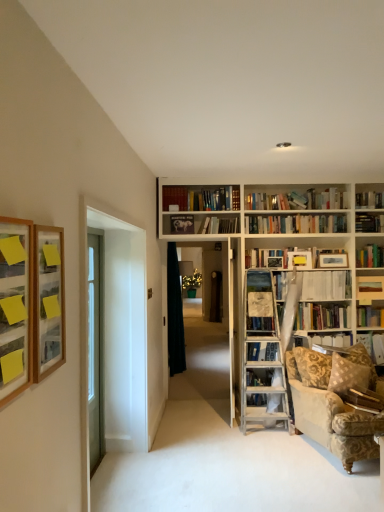
Question: Considering the relative sizes of clear glass door at left and wooden picture frame at left, the 2th picture frame when ordered from front to back, in the image provided, is clear glass door at left taller than wooden picture frame at left, the 2th picture frame when ordered from front to back,?

Choices:
 (A) no
 (B) yes

Answer: (B)

Question: From the image's perspective, does clear glass door at left appear lower than wooden picture frame at left, the 2th picture frame viewed from the right?

Choices:
 (A) yes
 (B) no

Answer: (A)

Question: Is clear glass door at left facing away from wooden picture frame at left, the 2th picture frame positioned from the left?

Choices:
 (A) no
 (B) yes

Answer: (A)

Question: Is clear glass door at left smaller than wooden picture frame at left, the 2th picture frame positioned from the back?

Choices:
 (A) no
 (B) yes

Answer: (A)

Question: Is clear glass door at left oriented towards wooden picture frame at left, the 2th picture frame positioned from the left?

Choices:
 (A) yes
 (B) no

Answer: (B)

Question: Can you confirm if clear glass door at left is thinner than wooden picture frame at left, the 2th picture frame viewed from the right?

Choices:
 (A) yes
 (B) no

Answer: (B)

Question: Would you say wooden picture frame at left, the 2th picture frame viewed from the right, contains white paper book at upper center, the 2th book viewed from the top?

Choices:
 (A) yes
 (B) no

Answer: (B)

Question: Is wooden picture frame at left, the 2th picture frame viewed from the right, taller than white paper book at upper center, which ranks as the fourth book in bottom-to-top order?

Choices:
 (A) no
 (B) yes

Answer: (B)

Question: Can you confirm if wooden picture frame at left, the 2th picture frame viewed from the right, is bigger than white paper book at upper center, the 2th book viewed from the top?

Choices:
 (A) yes
 (B) no

Answer: (B)

Question: Is wooden picture frame at left, the 2th picture frame positioned from the left, facing towards white paper book at upper center, which is counted as the second book, starting from the front?

Choices:
 (A) no
 (B) yes

Answer: (A)

Question: From a real-world perspective, does wooden picture frame at left, the 2th picture frame viewed from the right, stand above white paper book at upper center, which is counted as the second book, starting from the front?

Choices:
 (A) no
 (B) yes

Answer: (B)

Question: Is wooden picture frame at left, the 2th picture frame viewed from the right, at the right side of white paper book at upper center, which is the second book in left-to-right order?

Choices:
 (A) yes
 (B) no

Answer: (B)

Question: From a real-world perspective, does clear glass door at left stand above hardcover book at right, marked as the 4th book in a top-to-bottom arrangement?

Choices:
 (A) yes
 (B) no

Answer: (A)